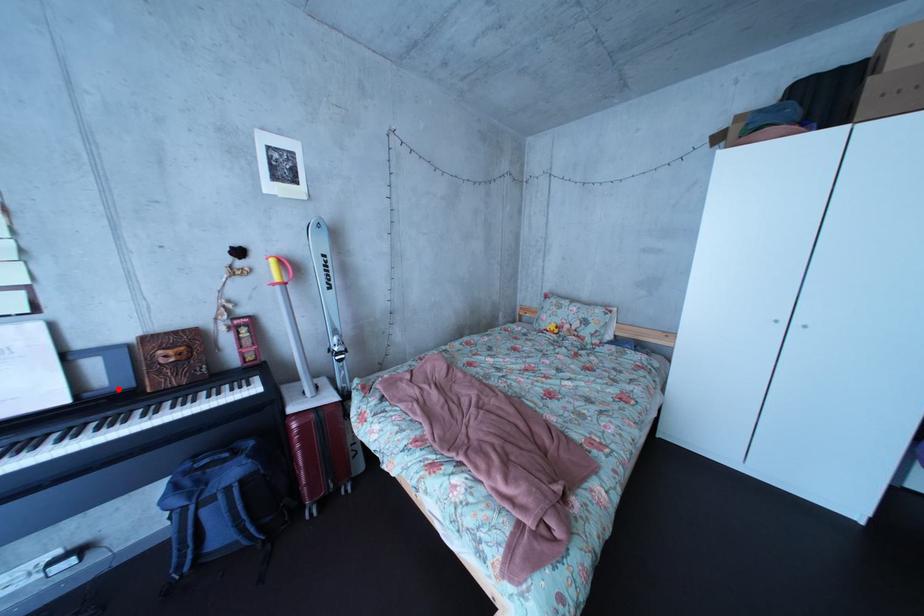
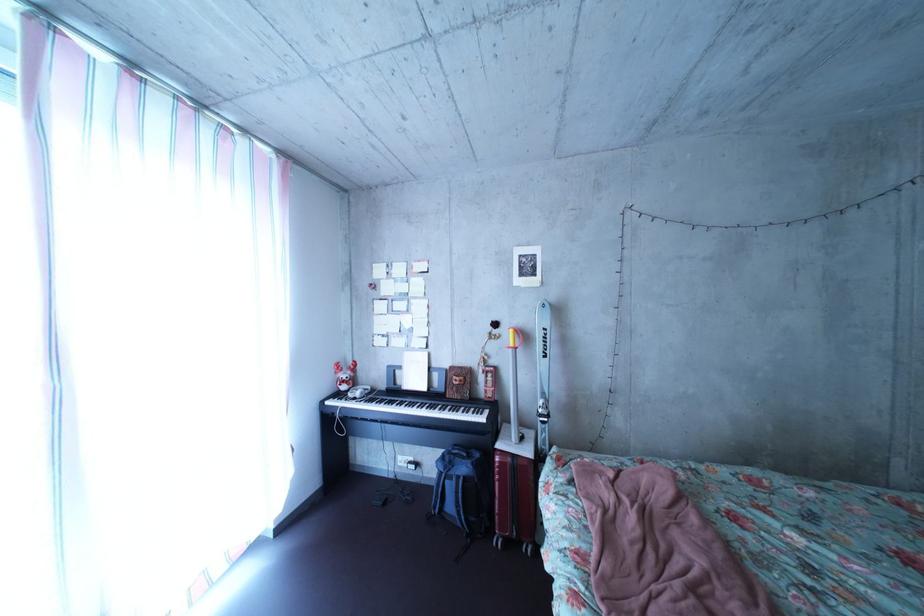
The point at the highlighted location is marked in the first image. Where is the corresponding point in the second image?

(452, 392)